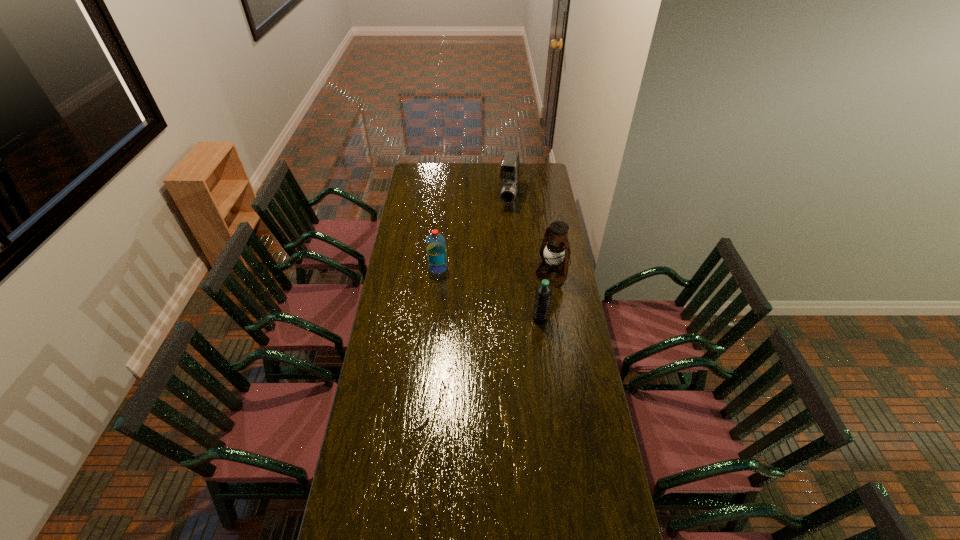
Where is `free spot located 0.290m on the back of the nearer water bottle`? free spot located 0.290m on the back of the nearer water bottle is located at coordinates (534, 269).

You are a GUI agent. You are given a task and a screenshot of the screen. Output one action in this format:
    pyautogui.click(x=<x>, y=<y>)
    Task: Click on the vacant position located at the front of the second object from left to right, highlighting the lens
    
    Given the screenshot: What is the action you would take?
    pyautogui.click(x=497, y=257)

Image resolution: width=960 pixels, height=540 pixels. Identify the location of vacant space located 0.220m at the front of the second object from left to right, highlighting the lens. (502, 237).

The height and width of the screenshot is (540, 960). I want to click on vacant area situated 0.310m at the front of the second object from left to right, highlighting the lens, so click(499, 247).

Identify the location of vacant space located on the side of the tallest object, there is a wick adjustment knob. (480, 312).

Find the location of a particular element. The width and height of the screenshot is (960, 540). free space located on the side of the tallest object, there is a wick adjustment knob is located at coordinates (525, 288).

Where is `vacant space located on the side of the tallest object, there is a wick adjustment knob`? The height and width of the screenshot is (540, 960). vacant space located on the side of the tallest object, there is a wick adjustment knob is located at coordinates (532, 285).

Locate an element on the screen. The height and width of the screenshot is (540, 960). water bottle located in the right edge section of the desktop is located at coordinates (543, 295).

Find the location of a particular element. Image resolution: width=960 pixels, height=540 pixels. lantern that is at the right edge is located at coordinates (557, 252).

In the image, there is a desktop. Where is `vacant space at the near edge`? This screenshot has height=540, width=960. vacant space at the near edge is located at coordinates (398, 525).